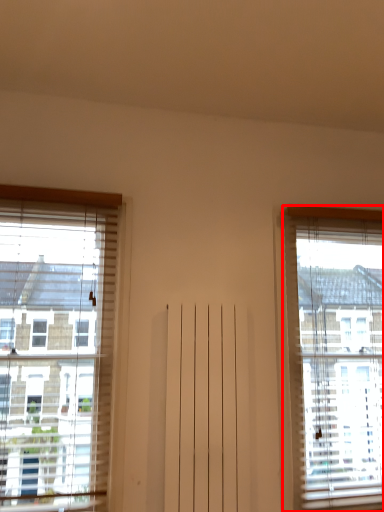
Question: From the image's perspective, where is window (annotated by the red box) located in relation to window in the image?

Choices:
 (A) below
 (B) above

Answer: (A)